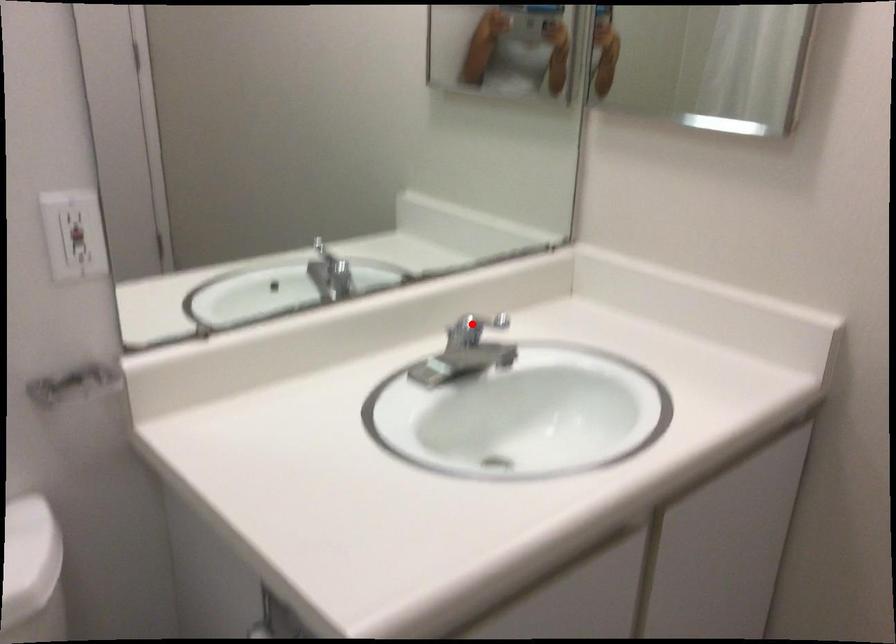
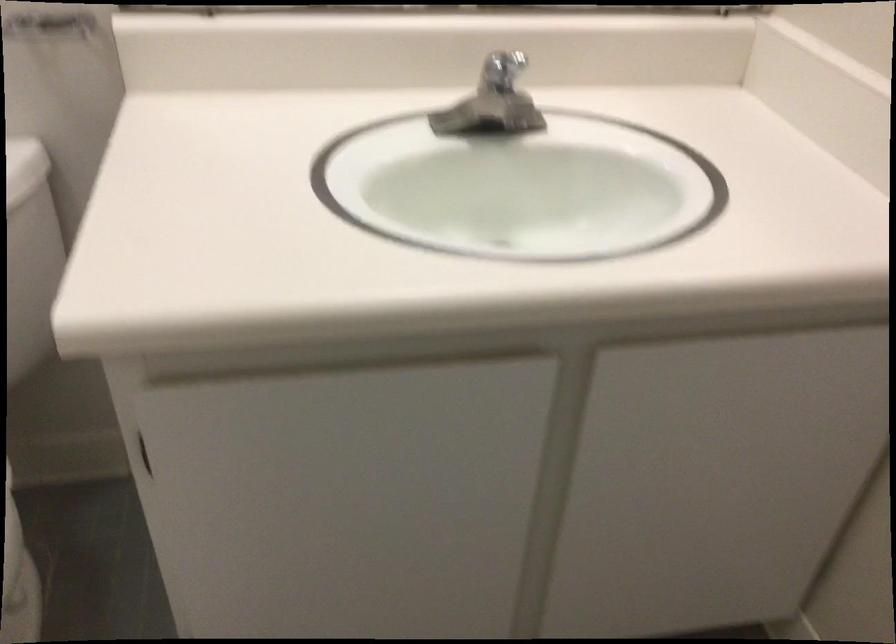
Question: I am providing you with two images of the same scene from different viewpoints. Given a red point in image1, look at the same physical point in image2. Is it:

Choices:
 (A) Closer to the viewpoint
 (B) Farther from the viewpoint

Answer: (A)